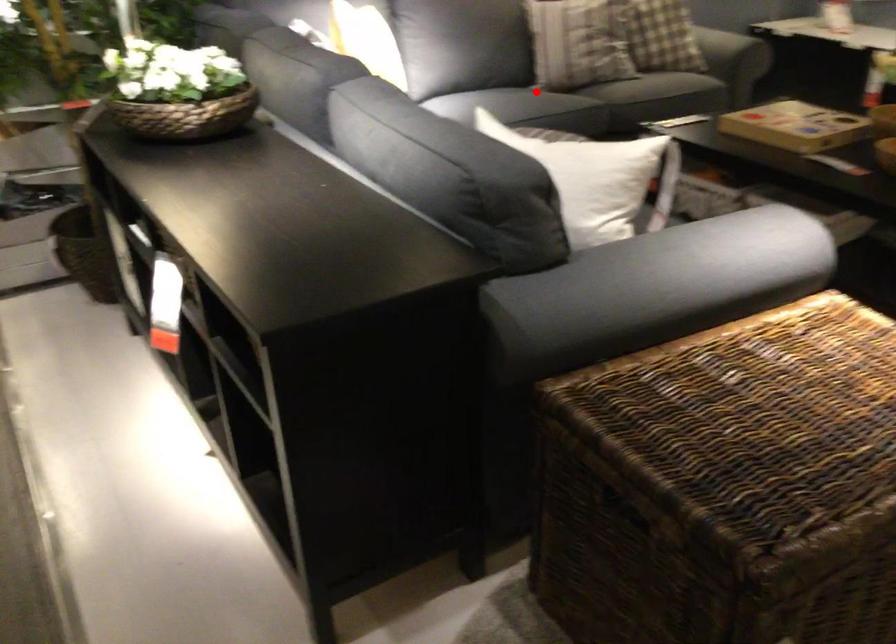
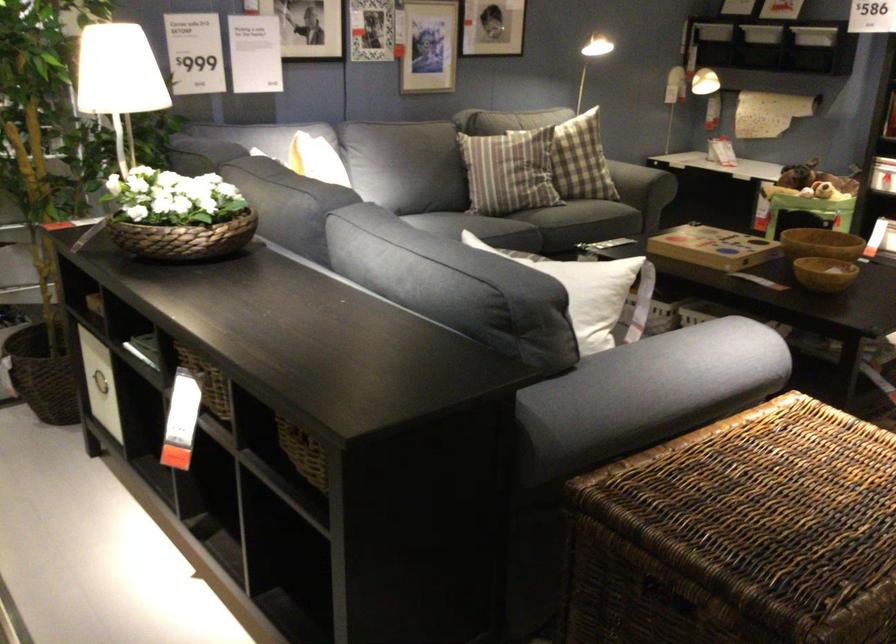
In the second image, find the point that corresponds to the highlighted location in the first image.

(484, 227)